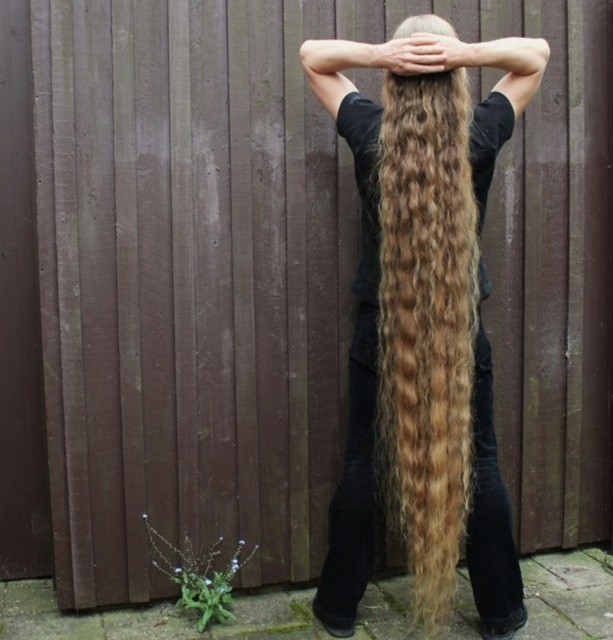
Locate an element on the screen. golden wavy hair at back is located at coordinates (427, 324).

Based on the photo, does golden wavy hair at back have a lesser width compared to blonde curly hair at center?

No, golden wavy hair at back is not thinner than blonde curly hair at center.

Locate an element on the screen. This screenshot has width=613, height=640. golden wavy hair at back is located at coordinates (427, 324).

The width and height of the screenshot is (613, 640). I want to click on golden wavy hair at back, so click(427, 324).

Is golden wavy hair at center taller than golden wavy hair at back?

Indeed, golden wavy hair at center has a greater height compared to golden wavy hair at back.

Does point (381, 273) lie behind point (411, 83)?

That is True.

Image resolution: width=613 pixels, height=640 pixels. Find the location of `golden wavy hair at center`. golden wavy hair at center is located at coordinates (422, 321).

What are the coordinates of `golden wavy hair at center` in the screenshot? It's located at (422, 321).

Is point (446, 500) positioned in front of point (427, 24)?

Yes, point (446, 500) is closer to viewer.

Can you confirm if golden wavy hair at center is wider than blonde curly hair at center?

Correct, the width of golden wavy hair at center exceeds that of blonde curly hair at center.

Which is in front, point (447, 288) or point (427, 29)?

Point (447, 288) is more forward.

You are a GUI agent. You are given a task and a screenshot of the screen. Output one action in this format:
    pyautogui.click(x=<x>, y=<y>)
    Task: Click on the golden wavy hair at center
    The height and width of the screenshot is (640, 613).
    Given the screenshot: What is the action you would take?
    pyautogui.click(x=422, y=321)